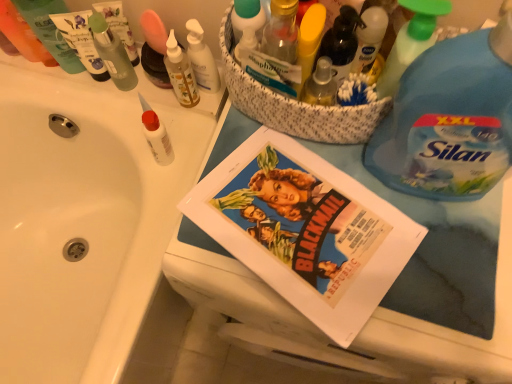
Where is `matte paper comic book at center`? The width and height of the screenshot is (512, 384). matte paper comic book at center is located at coordinates (x=305, y=230).

Describe the element at coordinates (305, 230) in the screenshot. I see `matte paper comic book at center` at that location.

Describe the element at coordinates (247, 25) in the screenshot. I see `translucent plastic bottle at upper center, which is the 2th toiletry from right to left` at that location.

What do you see at coordinates (23, 35) in the screenshot?
I see `translucent plastic bottle at upper left, arranged as the 8th toiletry when viewed from the right` at bounding box center [23, 35].

Describe the element at coordinates (201, 59) in the screenshot. I see `translucent plastic pump bottle at upper center, the 6th toiletry in the left-to-right sequence` at that location.

Measure the distance between translucent glass bottle at upper center, the first toiletry in the right-to-left sequence, and camera.

A distance of 19.63 inches exists between translucent glass bottle at upper center, the first toiletry in the right-to-left sequence, and camera.

The height and width of the screenshot is (384, 512). Find the location of `matte paper comic book at center`. matte paper comic book at center is located at coordinates pyautogui.click(x=305, y=230).

Which of these two, translucent plastic bottle at upper left, arranged as the 8th toiletry when viewed from the right, or translucent glass bottle at upper center, which is the eighth toiletry from left to right, is thinner?

translucent glass bottle at upper center, which is the eighth toiletry from left to right, is thinner.

Which is closer to the camera, (22, 41) or (275, 26)?

Point (22, 41) is farther from the camera than point (275, 26).

Based on the photo, who is taller, translucent plastic bottle at upper left, which ranks as the 1th toiletry in left-to-right order, or translucent glass bottle at upper center, which is the eighth toiletry from left to right?

Standing taller between the two is translucent plastic bottle at upper left, which ranks as the 1th toiletry in left-to-right order.

From a real-world perspective, which is physically below, translucent plastic bottle at upper left, which ranks as the 1th toiletry in left-to-right order, or translucent glass bottle at upper center, which is the eighth toiletry from left to right?

translucent plastic bottle at upper left, which ranks as the 1th toiletry in left-to-right order, from a real-world perspective.

Which object is thinner, blue plastic bottle at right, positioned as the 2th cleaning product in left-to-right order, or translucent plastic bottle at upper center, which is the seventh toiletry from left to right?

translucent plastic bottle at upper center, which is the seventh toiletry from left to right, is thinner.

Which of these two, blue plastic bottle at right, the first cleaning product when ordered from right to left, or translucent plastic bottle at upper center, which is the 2th toiletry from right to left, is bigger?

Bigger between the two is blue plastic bottle at right, the first cleaning product when ordered from right to left.

Which point is more distant from viewer, (505, 106) or (264, 18)?

Point (264, 18)

Are blue plastic bottle at right, the first cleaning product when ordered from right to left, and matte green tube at upper left, the sixth toiletry positioned from the right, located far from each other?

No, there isn't a large distance between blue plastic bottle at right, the first cleaning product when ordered from right to left, and matte green tube at upper left, the sixth toiletry positioned from the right.

What's the angular difference between blue plastic bottle at right, positioned as the 2th cleaning product in left-to-right order, and matte green tube at upper left, which is the third toiletry in left-to-right order,'s facing directions?

7.7 degrees.

From the image's perspective, is blue plastic bottle at right, the first cleaning product when ordered from right to left, located above matte green tube at upper left, the sixth toiletry positioned from the right?

No, from the image's perspective, blue plastic bottle at right, the first cleaning product when ordered from right to left, is not over matte green tube at upper left, the sixth toiletry positioned from the right.

Considering the sizes of blue plastic bottle at right, the first cleaning product when ordered from right to left, and matte green tube at upper left, which is the third toiletry in left-to-right order, in the image, is blue plastic bottle at right, the first cleaning product when ordered from right to left, wider or thinner than matte green tube at upper left, which is the third toiletry in left-to-right order,?

blue plastic bottle at right, the first cleaning product when ordered from right to left, is wider than matte green tube at upper left, which is the third toiletry in left-to-right order.

Between blue plastic bottle at right, the first cleaning product when ordered from right to left, and green plastic spray bottle at upper right, marked as the 2th cleaning product in a right-to-left arrangement, which one has more height?

With more height is blue plastic bottle at right, the first cleaning product when ordered from right to left.

Which object is closer to the camera, blue plastic bottle at right, the first cleaning product when ordered from right to left, or green plastic spray bottle at upper right, marked as the 2th cleaning product in a right-to-left arrangement?

blue plastic bottle at right, the first cleaning product when ordered from right to left.

Which of these two, blue plastic bottle at right, positioned as the 2th cleaning product in left-to-right order, or green plastic spray bottle at upper right, marked as the 2th cleaning product in a right-to-left arrangement, is bigger?

With larger size is blue plastic bottle at right, positioned as the 2th cleaning product in left-to-right order.

Can green plastic spray bottle at upper right, marked as the 2th cleaning product in a right-to-left arrangement, be found inside blue plastic bottle at right, the first cleaning product when ordered from right to left?

Definitely not — green plastic spray bottle at upper right, marked as the 2th cleaning product in a right-to-left arrangement, is not inside blue plastic bottle at right, the first cleaning product when ordered from right to left.

Find the location of a particular element. This screenshot has width=512, height=384. sink that is behind the translucent plastic bottle at upper center, which is the seventh toiletry from left to right is located at coordinates (84, 218).

Is translucent plastic bottle at upper center, which is the seventh toiletry from left to right, to the right of white glossy sink at upper left from the viewer's perspective?

Indeed, translucent plastic bottle at upper center, which is the seventh toiletry from left to right, is positioned on the right side of white glossy sink at upper left.

Is translucent plastic bottle at upper center, which is the 2th toiletry from right to left, aimed at white glossy sink at upper left?

No, translucent plastic bottle at upper center, which is the 2th toiletry from right to left, is not oriented towards white glossy sink at upper left.

Could white paper at upper center be considered to be inside translucent plastic bottle at upper center?

No, white paper at upper center is not surrounded by translucent plastic bottle at upper center.

Is point (336, 64) positioned in front of point (219, 123)?

Yes, it is in front of point (219, 123).

From the image's perspective, is translucent plastic bottle at upper center above or below white paper at upper center?

translucent plastic bottle at upper center is above white paper at upper center.

Is translucent plastic bottle at upper center aimed at white paper at upper center?

No, translucent plastic bottle at upper center is not turned towards white paper at upper center.

In terms of height, does translucent glass bottle at upper center, which is the eighth toiletry from left to right, look taller or shorter compared to white matte glue at upper left, the fifth toiletry from the left?

Clearly, translucent glass bottle at upper center, which is the eighth toiletry from left to right, is shorter compared to white matte glue at upper left, the fifth toiletry from the left.

Between translucent glass bottle at upper center, the first toiletry in the right-to-left sequence, and white matte glue at upper left, the fifth toiletry from the left, which one has larger size?

white matte glue at upper left, the fifth toiletry from the left.

Is translucent glass bottle at upper center, the first toiletry in the right-to-left sequence, wider than white matte glue at upper left, placed as the 4th toiletry when sorted from right to left?

No.

Identify the location of the 7th toiletry counting from the right side of the translucent plastic bottle at upper left, which ranks as the 1th toiletry in left-to-right order. (281, 31).

The image size is (512, 384). Find the location of `toiletry that is the 3rd object located above the blue plastic bottle at right, positioned as the 2th cleaning product in left-to-right order (from the image's perspective)`. toiletry that is the 3rd object located above the blue plastic bottle at right, positioned as the 2th cleaning product in left-to-right order (from the image's perspective) is located at coordinates (247, 25).

From the image, which object appears to be nearer to translucent plastic bottle at upper center, matte paper comic book at center or green plastic spray bottle at upper right, placed as the 1th cleaning product when sorted from left to right?

green plastic spray bottle at upper right, placed as the 1th cleaning product when sorted from left to right, is positioned closer to the anchor translucent plastic bottle at upper center.

When comparing their distances from white glossy sink at upper left, does translucent plastic bottle at upper center, which is the seventh toiletry from left to right, or matte paper comic book at center seem further?

The object further to white glossy sink at upper left is translucent plastic bottle at upper center, which is the seventh toiletry from left to right.

From the image, which object appears to be farther from green translucent bottle at upper left, which is the 4th toiletry in left-to-right order, translucent plastic bottle at upper center or matte green tube at upper left, which is the third toiletry in left-to-right order?

translucent plastic bottle at upper center lies further to green translucent bottle at upper left, which is the 4th toiletry in left-to-right order, than the other object.

Looking at the image, which one is located closer to translucent plastic bottle at upper center, white matte glue at upper left, the fifth toiletry from the left, or matte paper comic book at center?

matte paper comic book at center lies closer to translucent plastic bottle at upper center than the other object.

Looking at the image, which one is located closer to white matte glue at upper left, placed as the 4th toiletry when sorted from right to left, matte paper comic book at center or translucent plastic bottle at upper center?

matte paper comic book at center.

When comparing their distances from translucent glass bottle at upper center, which is the eighth toiletry from left to right, does white paper at upper center or translucent plastic bottle at upper left, arranged as the 8th toiletry when viewed from the right, seem further?

translucent plastic bottle at upper left, arranged as the 8th toiletry when viewed from the right, is positioned further to the anchor translucent glass bottle at upper center, which is the eighth toiletry from left to right.

When comparing their distances from blue plastic bottle at right, the first cleaning product when ordered from right to left, does green translucent bottle at upper left, the fifth toiletry in the right-to-left sequence, or white matte glue at upper left, the fifth toiletry from the left, seem further?

green translucent bottle at upper left, the fifth toiletry in the right-to-left sequence.

From the image, which object appears to be nearer to translucent glass bottle at upper center, which is the eighth toiletry from left to right, green translucent bottle at upper left, the fifth toiletry in the right-to-left sequence, or white glossy sink at upper left?

Among the two, green translucent bottle at upper left, the fifth toiletry in the right-to-left sequence, is located nearer to translucent glass bottle at upper center, which is the eighth toiletry from left to right.

Locate an element on the screen. The width and height of the screenshot is (512, 384). cleaning product between translucent glass bottle at upper center, the first toiletry in the right-to-left sequence, and blue plastic bottle at right, the first cleaning product when ordered from right to left, from left to right is located at coordinates (411, 41).

Identify the location of toiletry between translucent plastic bottle at upper center, which is the 2th toiletry from right to left, and translucent plastic pump bottle at upper center, positioned as the 3th toiletry in right-to-left order, in the front-back direction. This screenshot has height=384, width=512. (156, 135).

This screenshot has width=512, height=384. Identify the location of sink situated between translucent plastic bottle at upper left, which ranks as the 1th toiletry in left-to-right order, and white paper at upper center from left to right. (84, 218).

In order to click on bottle situated between translucent glass bottle at upper center, the first toiletry in the right-to-left sequence, and green plastic spray bottle at upper right, placed as the 1th cleaning product when sorted from left to right, from left to right in this screenshot , I will do `click(341, 42)`.